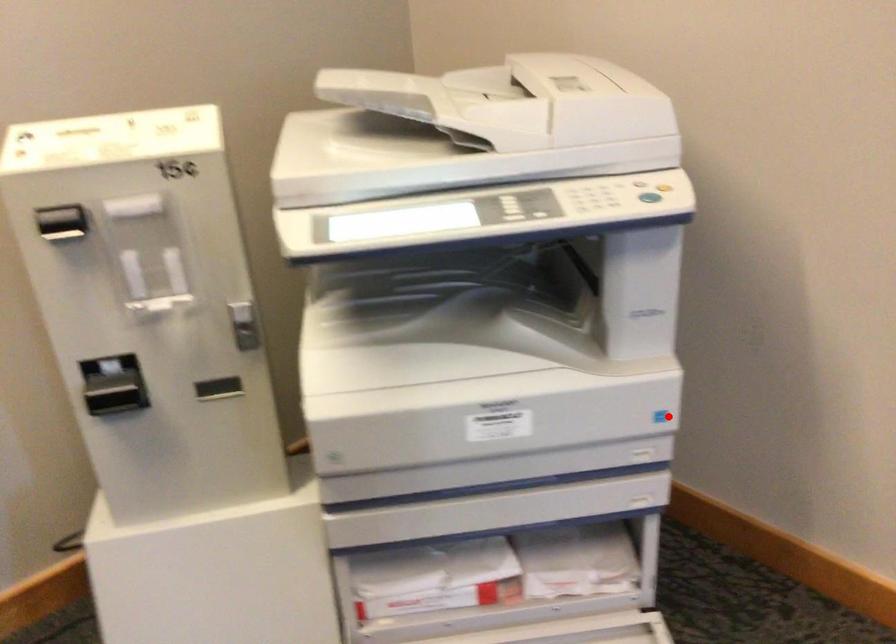
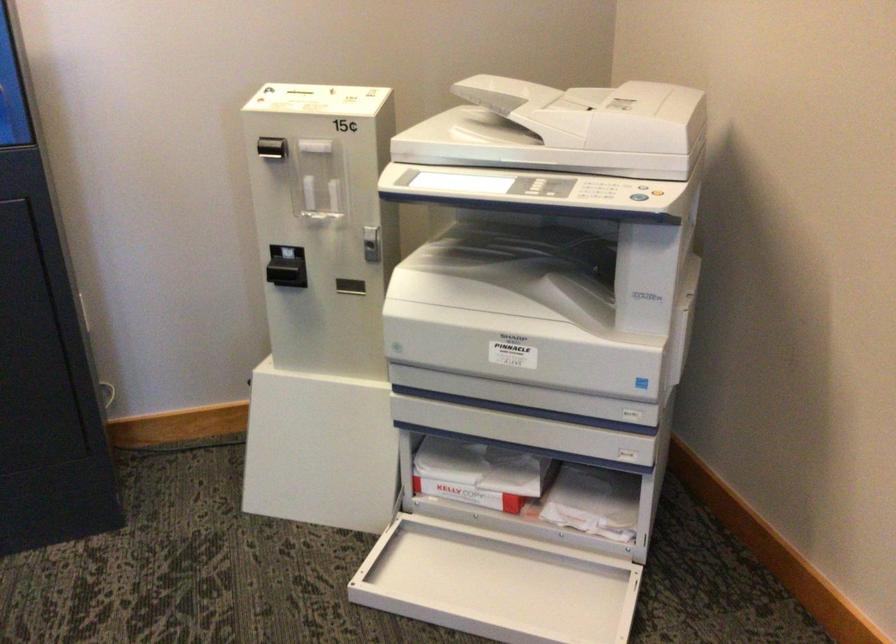
Where in the second image is the point corresponding to the highlighted location from the first image?

(643, 384)